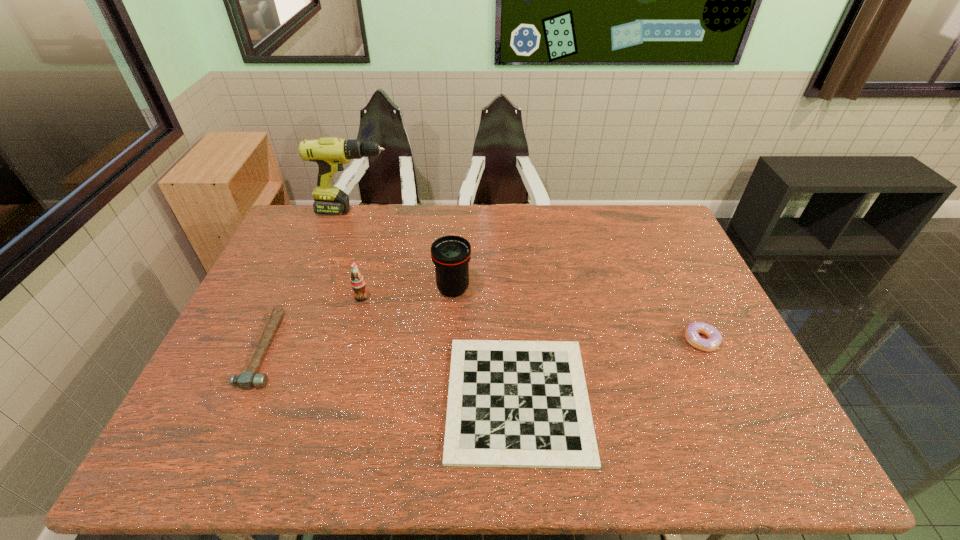
The image size is (960, 540). In order to click on free space that is in between the tallest object and the checkerboard in this screenshot , I will do `click(437, 305)`.

Locate an element on the screen. Image resolution: width=960 pixels, height=540 pixels. vacant region between the farthest object and the rightmost object is located at coordinates (528, 275).

I want to click on the third closest object to the checkerboard, so click(x=357, y=281).

Where is `object that is the fifth closest to the doughnut`? This screenshot has height=540, width=960. object that is the fifth closest to the doughnut is located at coordinates (246, 380).

Identify the location of vacant area that satisfies the following two spatial constraints: 1. on the handle side of the rightmost object; 2. on the left side of the drill. (309, 340).

The height and width of the screenshot is (540, 960). Find the location of `vacant region that satisfies the following two spatial constraints: 1. on the front side of the fourth tallest object; 2. on the striking face of the fifth tallest object`. vacant region that satisfies the following two spatial constraints: 1. on the front side of the fourth tallest object; 2. on the striking face of the fifth tallest object is located at coordinates (706, 349).